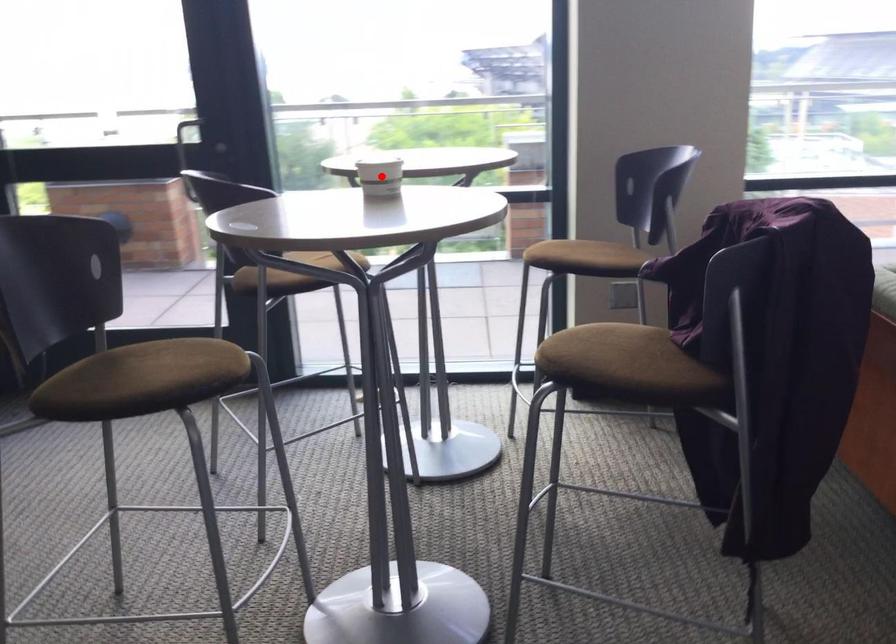
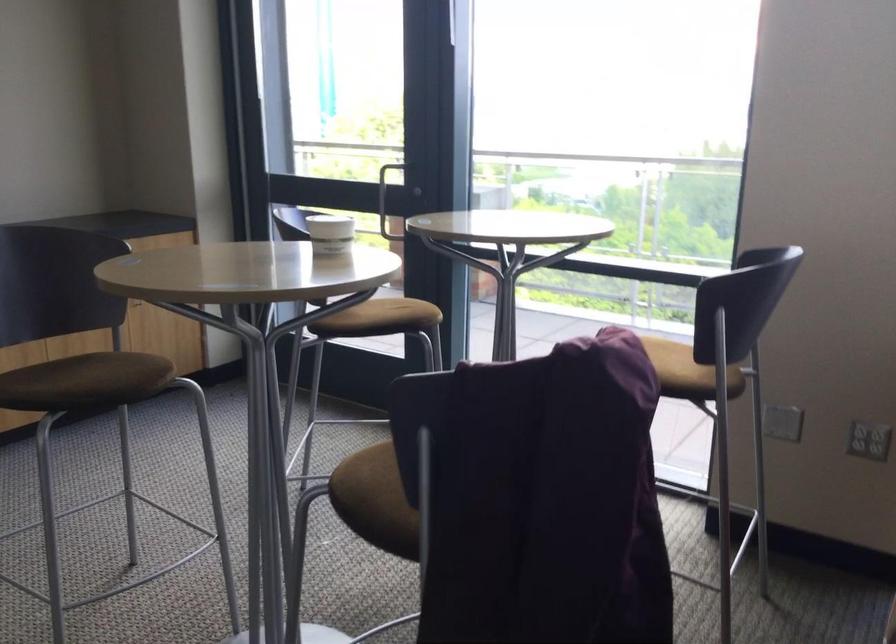
The point at the highlighted location is marked in the first image. Where is the corresponding point in the second image?

(330, 234)